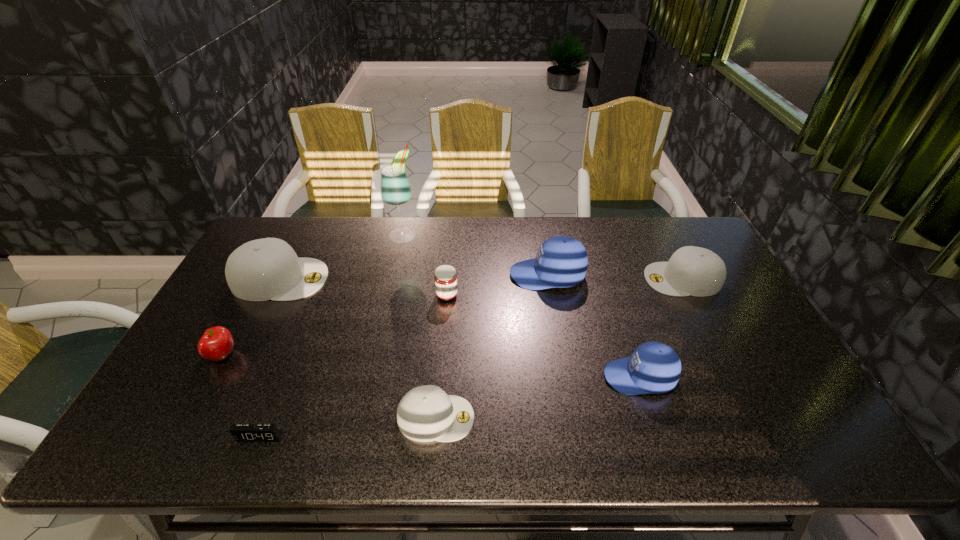
You are a GUI agent. You are given a task and a screenshot of the screen. Output one action in this format:
    pyautogui.click(x=<x>, y=<y>)
    Task: Click on the vacant area located 0.320m on the front-facing side of the rightmost gray cap
    
    Given the screenshot: What is the action you would take?
    pyautogui.click(x=544, y=279)

Find the location of a particular element. Image resolution: width=960 pixels, height=540 pixels. vacant space located 0.050m on the front-facing side of the smaller blue cap is located at coordinates (585, 377).

The image size is (960, 540). I want to click on vacant space situated on the front-facing side of the smaller blue cap, so click(498, 377).

Identify the location of free space located 0.230m on the front-facing side of the smaller blue cap. (514, 377).

In order to click on free space located on the right of the red jam in this screenshot , I will do `click(527, 295)`.

The image size is (960, 540). I want to click on vacant area situated 0.070m on the left of the red apple, so click(x=182, y=355).

This screenshot has width=960, height=540. In order to click on vacant area situated 0.340m on the front-facing side of the nearest gray cap in this screenshot , I will do `click(618, 418)`.

The image size is (960, 540). What are the coordinates of `object at the far edge` in the screenshot? It's located at (395, 189).

This screenshot has height=540, width=960. What are the coordinates of `cap that is at the near edge` in the screenshot? It's located at (426, 413).

Identify the location of alarm clock situated at the near edge. Image resolution: width=960 pixels, height=540 pixels. (241, 432).